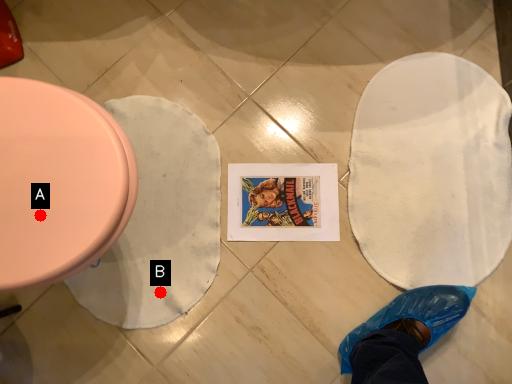
Question: Two points are circled on the image, labeled by A and B beside each circle. Which point is further to the camera?

Choices:
 (A) A is further
 (B) B is further

Answer: (B)